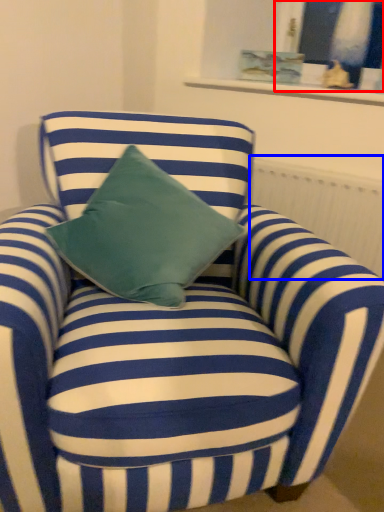
Question: Among these objects, which one is nearest to the camera, window (highlighted by a red box) or radiator (highlighted by a blue box)?

Choices:
 (A) window
 (B) radiator

Answer: (B)